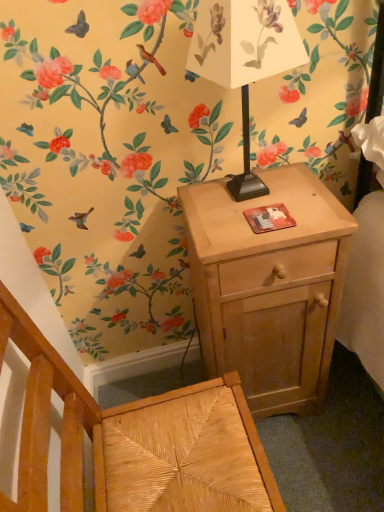
Question: Is woven wood armchair at lower left to the right of white paper lampshade at upper center from the viewer's perspective?

Choices:
 (A) yes
 (B) no

Answer: (B)

Question: Is woven wood armchair at lower left bigger than white paper lampshade at upper center?

Choices:
 (A) yes
 (B) no

Answer: (A)

Question: Does woven wood armchair at lower left turn towards white paper lampshade at upper center?

Choices:
 (A) yes
 (B) no

Answer: (B)

Question: Is woven wood armchair at lower left positioned beyond the bounds of white paper lampshade at upper center?

Choices:
 (A) no
 (B) yes

Answer: (B)

Question: Is there a large distance between woven wood armchair at lower left and white paper lampshade at upper center?

Choices:
 (A) yes
 (B) no

Answer: (B)

Question: Is woven wood armchair at lower left positioned with its back to white paper lampshade at upper center?

Choices:
 (A) yes
 (B) no

Answer: (B)

Question: From the image's perspective, is woven wood armchair at lower left above light wood nightstand at right?

Choices:
 (A) yes
 (B) no

Answer: (B)

Question: Would you say woven wood armchair at lower left contains light wood nightstand at right?

Choices:
 (A) yes
 (B) no

Answer: (B)

Question: Is woven wood armchair at lower left shorter than light wood nightstand at right?

Choices:
 (A) no
 (B) yes

Answer: (A)

Question: Does woven wood armchair at lower left have a larger size compared to light wood nightstand at right?

Choices:
 (A) yes
 (B) no

Answer: (A)

Question: Is woven wood armchair at lower left wider than light wood nightstand at right?

Choices:
 (A) yes
 (B) no

Answer: (A)

Question: Does woven wood armchair at lower left come in front of light wood nightstand at right?

Choices:
 (A) no
 (B) yes

Answer: (B)

Question: From a real-world perspective, is white paper lampshade at upper center under woven wood armchair at lower left?

Choices:
 (A) yes
 (B) no

Answer: (B)